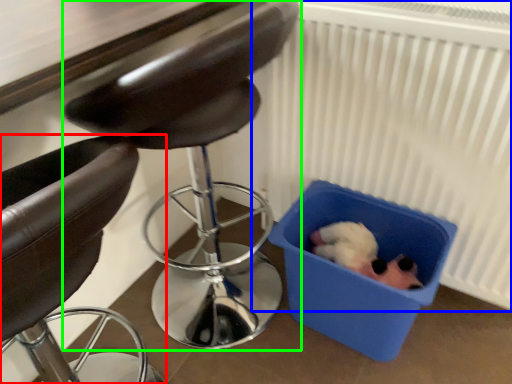
Question: Which is nearer to the chair (highlighted by a red box)? radiator (highlighted by a blue box) or chair (highlighted by a green box).

Choices:
 (A) radiator
 (B) chair

Answer: (A)